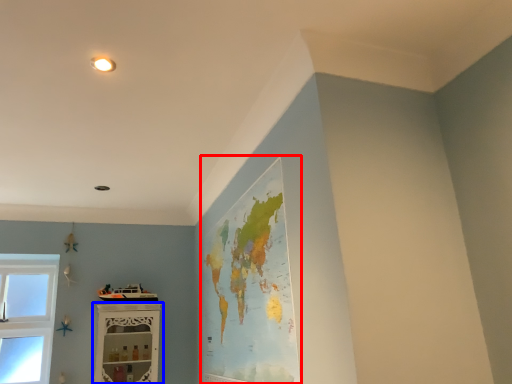
Question: Which of the following is the farthest to the observer, map (highlighted by a red box) or shelf (highlighted by a blue box)?

Choices:
 (A) map
 (B) shelf

Answer: (B)